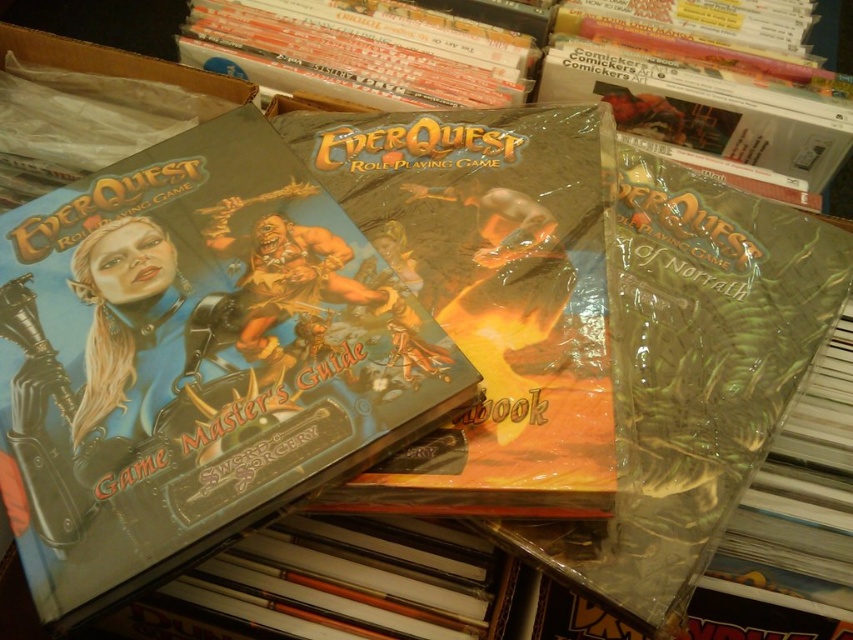
Is matte plastic everquest game master's guide at left to the right of shiny plastic everquest rpg book at center from the viewer's perspective?

No, matte plastic everquest game master's guide at left is not to the right of shiny plastic everquest rpg book at center.

Is matte plastic everquest game master's guide at left behind shiny plastic everquest rpg book at center?

No, matte plastic everquest game master's guide at left is closer to the viewer.

Is point (96, 433) closer to camera compared to point (601, 344)?

Yes, it is in front of point (601, 344).

Locate an element on the screen. The image size is (853, 640). matte plastic everquest game master's guide at left is located at coordinates (194, 358).

Is point (461, 346) farther from viewer compared to point (248, 4)?

No.

Is shiny plastic everquest rpg book at center below hardcover book at upper center?

Yes, shiny plastic everquest rpg book at center is below hardcover book at upper center.

Describe the element at coordinates (489, 294) in the screenshot. I see `shiny plastic everquest rpg book at center` at that location.

At what (x,y) coordinates should I click in order to perform the action: click on shiny plastic everquest rpg book at center. Please return your answer as a coordinate pair (x, y). The image size is (853, 640). Looking at the image, I should click on (489, 294).

Who is lower down, matte plastic everquest game master's guide at left or hardcover book at upper center?

matte plastic everquest game master's guide at left is below.

Can you confirm if matte plastic everquest game master's guide at left is wider than hardcover book at upper center?

No, matte plastic everquest game master's guide at left is not wider than hardcover book at upper center.

Is point (316, 188) farther from camera compared to point (482, 24)?

No, (316, 188) is in front of (482, 24).

In order to click on matte plastic everquest game master's guide at left in this screenshot , I will do (x=194, y=358).